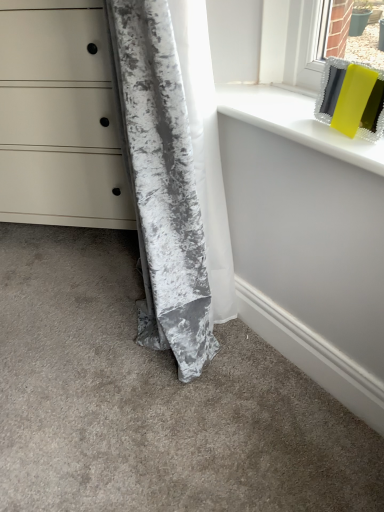
Question: Is white glossy window sill at upper right in front of or behind crushed velvet curtain at lower left in the image?

Choices:
 (A) behind
 (B) front

Answer: (A)

Question: Is point (x=225, y=112) closer or farther from the camera than point (x=195, y=262)?

Choices:
 (A) farther
 (B) closer

Answer: (B)

Question: Which object is positioned farthest from the matte white chest of drawers at lower left?

Choices:
 (A) crushed velvet curtain at lower left
 (B) white glossy window sill at upper right

Answer: (B)

Question: Based on their relative distances, which object is farther from the matte white chest of drawers at lower left?

Choices:
 (A) crushed velvet curtain at lower left
 (B) white glossy window sill at upper right

Answer: (B)